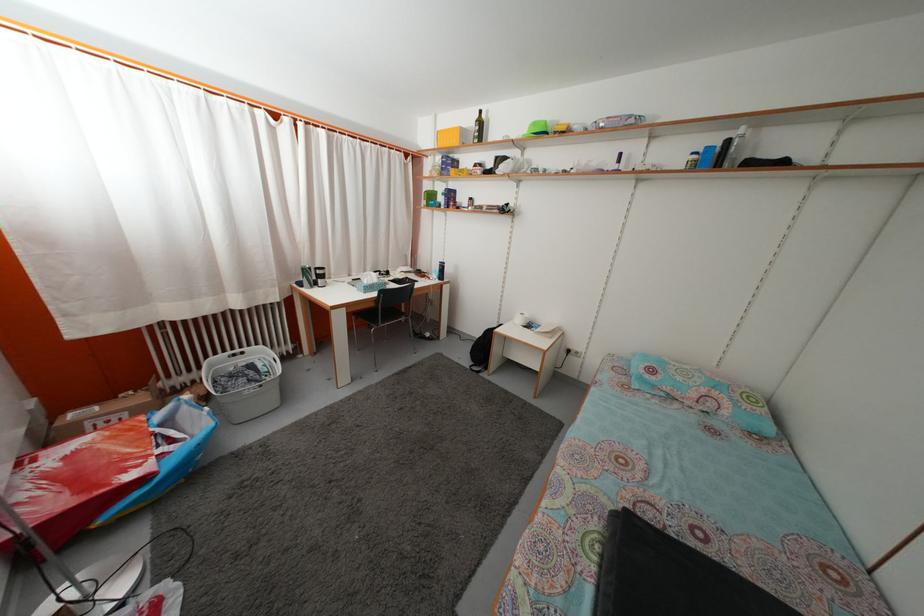
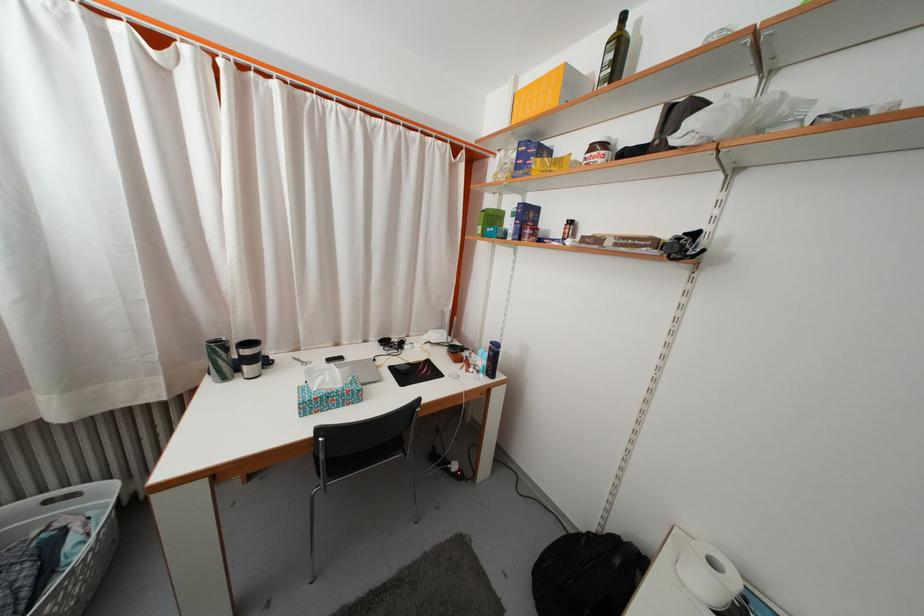
Question: Which direction would the cameraman need to move to produce the second image? Reply with the corresponding letter.

Choices:
 (A) Left
 (B) Right
 (C) Forward
 (D) Backward

Answer: (C)